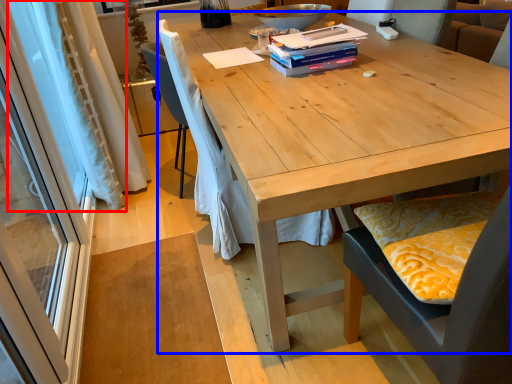
Question: Which object appears closest to the camera in this image, curtain (highlighted by a red box) or desk (highlighted by a blue box)?

Choices:
 (A) curtain
 (B) desk

Answer: (B)